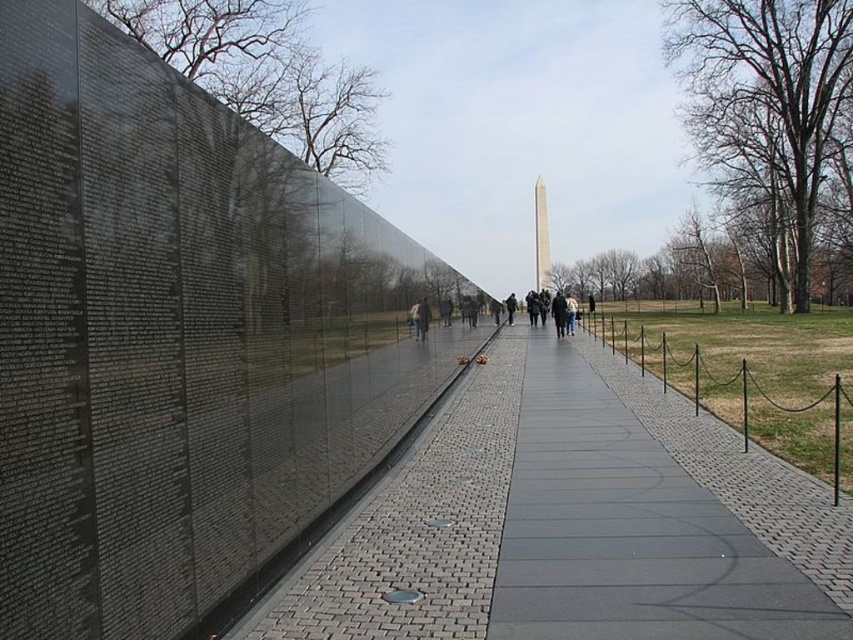
Question: Is gray concrete sidewalk at center to the right of polished marble obelisk at center from the viewer's perspective?

Choices:
 (A) no
 (B) yes

Answer: (A)

Question: Is gray concrete sidewalk at center below polished marble obelisk at center?

Choices:
 (A) no
 (B) yes

Answer: (B)

Question: Does gray concrete sidewalk at center appear on the left side of polished marble obelisk at center?

Choices:
 (A) yes
 (B) no

Answer: (A)